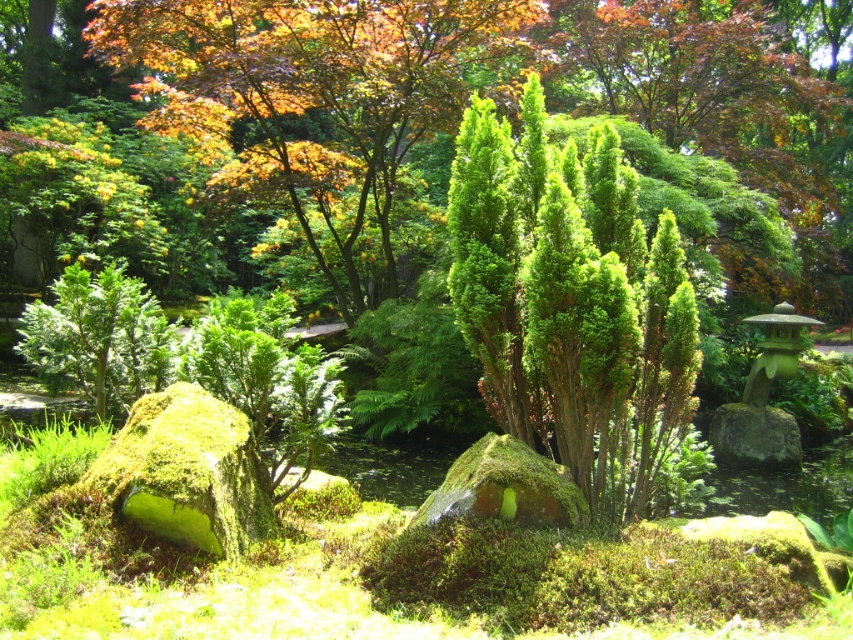
Can you confirm if green textured bush at center is taller than green textured shrub at upper center?

Yes, green textured bush at center is taller than green textured shrub at upper center.

Which of these two, green textured bush at center or green textured shrub at upper center, stands taller?

green textured bush at center is taller.

Is point (505, 237) positioned behind point (193, 6)?

No, it is not.

Locate an element on the screen. green textured bush at center is located at coordinates (572, 301).